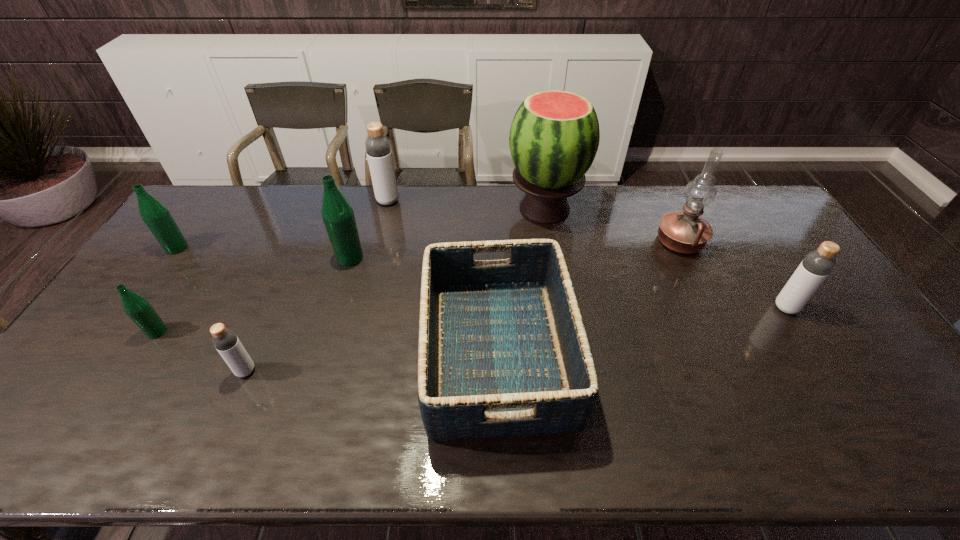
The height and width of the screenshot is (540, 960). Find the location of `object that is the seventh closest to the fifth bottle from right to left`. object that is the seventh closest to the fifth bottle from right to left is located at coordinates (685, 232).

Locate an element on the screen. The height and width of the screenshot is (540, 960). object identified as the fifth closest to the farthest gray bottle is located at coordinates (225, 341).

Find the location of a particular element. the second closest bottle to the second farthest gray bottle is located at coordinates (378, 148).

Where is `the closest bottle to the farthest gray bottle`? the closest bottle to the farthest gray bottle is located at coordinates (337, 213).

At what (x,y) coordinates should I click in order to perform the action: click on gray bottle that stands as the second closest to the blue basket. Please return your answer as a coordinate pair (x, y). The height and width of the screenshot is (540, 960). Looking at the image, I should click on coord(225,341).

Identify the location of the closest gray bottle relative to the basket. (378, 148).

Locate which green bottle is the second closest to the rightmost green bottle. Please provide its 2D coordinates. Your answer should be formatted as a tuple, i.e. [(x, y)], where the tuple contains the x and y coordinates of a point satisfying the conditions above.

[(156, 216)]

Select which green bottle is the closest to the farthest gray bottle. Please provide its 2D coordinates. Your answer should be formatted as a tuple, i.e. [(x, y)], where the tuple contains the x and y coordinates of a point satisfying the conditions above.

[(337, 213)]

At what (x,y) coordinates should I click in order to perform the action: click on free space that satisfies the following two spatial constraints: 1. on the back side of the nearest bottle; 2. on the left side of the eighth object from left to right. Please return your answer as a coordinate pair (x, y). Looking at the image, I should click on click(300, 242).